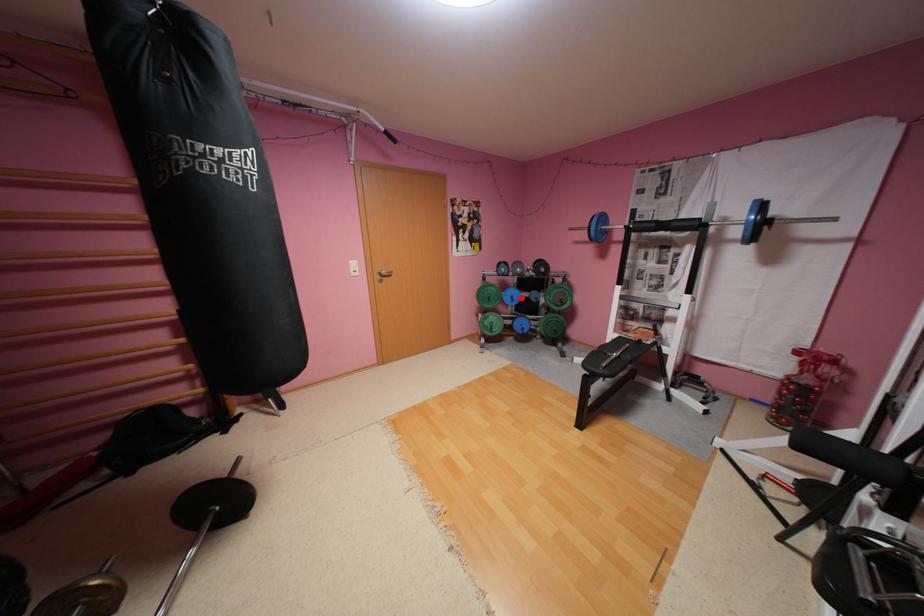
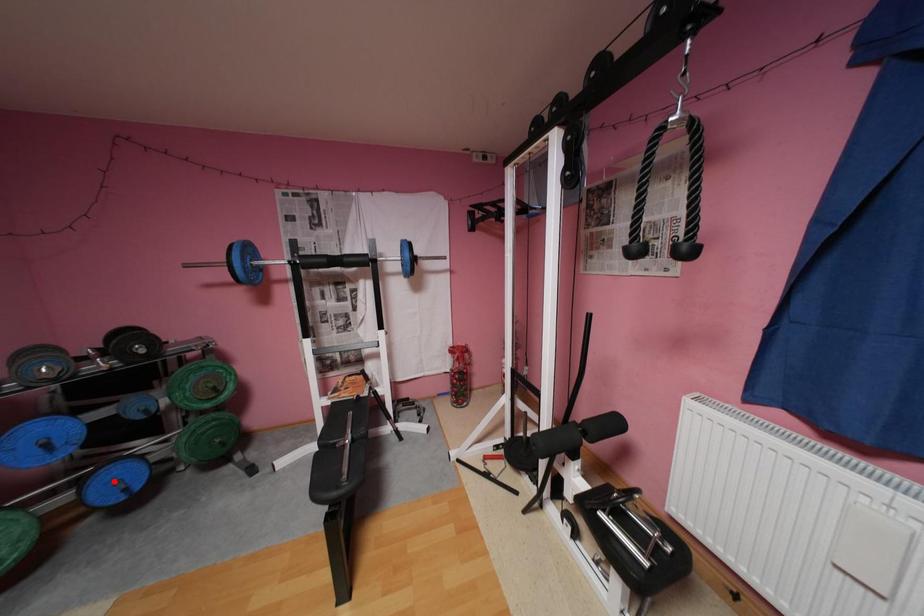
I am providing you with two images of the same scene from different viewpoints. A red point is marked on the first image and another point is marked on the second image. Are the points marked in image1 and image2 representing the same 3D position?

No